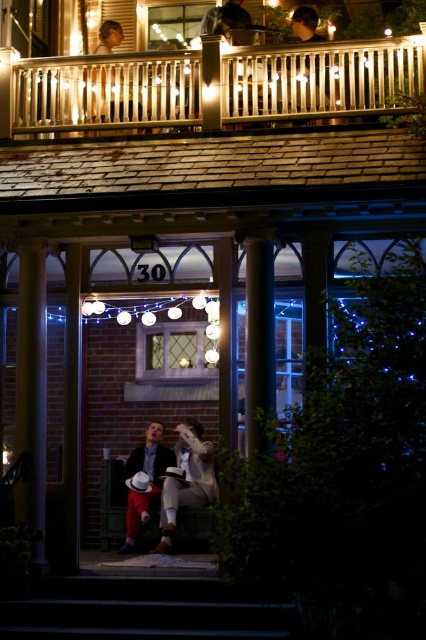
You are standing at the bottom of the smooth concrete stairs at lower center and want to greet the person wearing the white cotton shirt at center. Which direction should you move to approach them?

The smooth concrete stairs at lower center is in front of the white cotton shirt at center, so you should move forward to approach them.

Consider the image. You are standing on the porch and want to place a decorative wreath between the metallic silver railing at upper center and the matte black hair at upper center. Is the distance sufficient to fit the wreath?

The distance between the metallic silver railing at upper center and the matte black hair at upper center is 5.57 meters, so yes, the wreath can be placed between them as there is enough space.

You are standing at the entrance of the brick building and want to go down the smooth concrete stairs at lower center. Based on the coordinates provided in the description, can you determine if the stairs are directly in front of you or to one side?

The smooth concrete stairs at lower center is located at point [141,611], which indicates it is positioned towards the lower right side of the scene. Therefore, the stairs are not directly in front but to your right side.